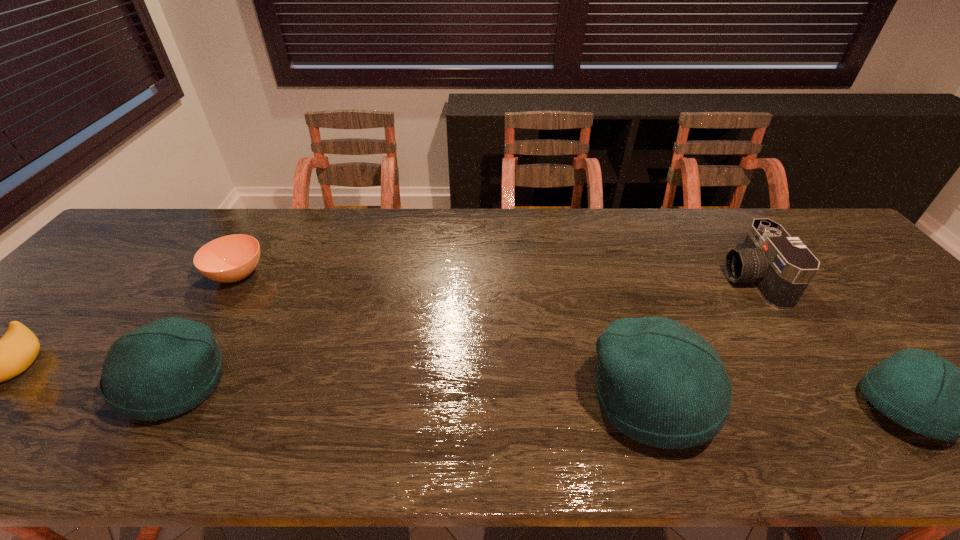
Where is `vacant space located on the front-facing side of the camera`? The image size is (960, 540). vacant space located on the front-facing side of the camera is located at coordinates (653, 280).

What are the coordinates of `vacant area situated 0.220m on the front-facing side of the camera` in the screenshot? It's located at (646, 280).

Image resolution: width=960 pixels, height=540 pixels. Find the location of `object that is at the far edge`. object that is at the far edge is located at coordinates (780, 267).

The width and height of the screenshot is (960, 540). In the image, there is a desktop. Identify the location of vacant space at the far edge. (303, 226).

I want to click on vacant space at the left edge of the desktop, so click(65, 354).

In order to click on vacant space at the right edge of the desktop in this screenshot , I will do `click(910, 315)`.

You are a GUI agent. You are given a task and a screenshot of the screen. Output one action in this format:
    pyautogui.click(x=<x>, y=<y>)
    Task: Click on the vacant space at the far left corner of the desktop
    The width and height of the screenshot is (960, 540).
    Given the screenshot: What is the action you would take?
    pyautogui.click(x=169, y=213)

Select which object appears as the fifth closest to the camera. Please provide its 2D coordinates. Your answer should be formatted as a tuple, i.e. [(x, y)], where the tuple contains the x and y coordinates of a point satisfying the conditions above.

[(1, 359)]

At what (x,y) coordinates should I click in order to perform the action: click on object that is the fifth closest to the duck. Please return your answer as a coordinate pair (x, y). This screenshot has height=540, width=960. Looking at the image, I should click on pyautogui.click(x=923, y=392).

This screenshot has width=960, height=540. Find the location of `the closest beanie relative to the soup bowl`. the closest beanie relative to the soup bowl is located at coordinates (163, 369).